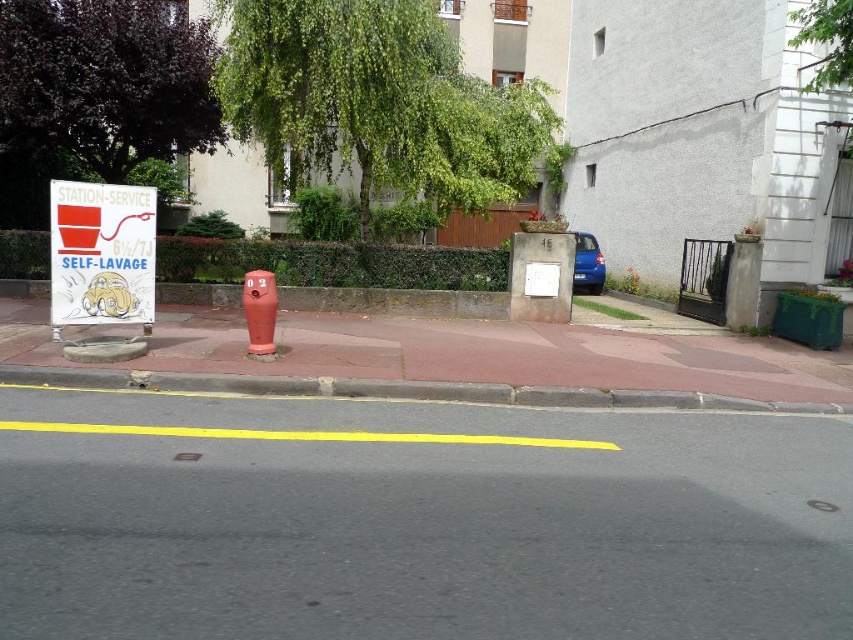
You are standing on the sidewalk and want to walk from the Station Service sign to the red cylindrical object. Which point, point (111, 253) or point (250, 344), is closer to your starting position?

Point (111, 253) is closer to the viewer than point (250, 344), so it is closer to your starting position.

You are a delivery person trying to park your small delivery cart between the concrete at center and the matte red hydrant at center. Can you fit your cart there if the cart requires 2 square meters of space?

The concrete at center occupies less space than the matte red hydrant at center, so the available space between them may be insufficient for your cart requiring 2 square meters. Check the actual dimensions before deciding.

You are a delivery driver who needs to park your vehicle on the sidewalk. The sidewalk is narrow, and you must ensure there is enough space between the concrete at center and the red plastic sign at left. Can you park your vehicle without blocking either object?

The concrete at center is closer to the viewer than the red plastic sign at left, so parking between them may be possible if there is sufficient space. However, the exact distance isn not provided, so it is recommended to check the available space before parking.